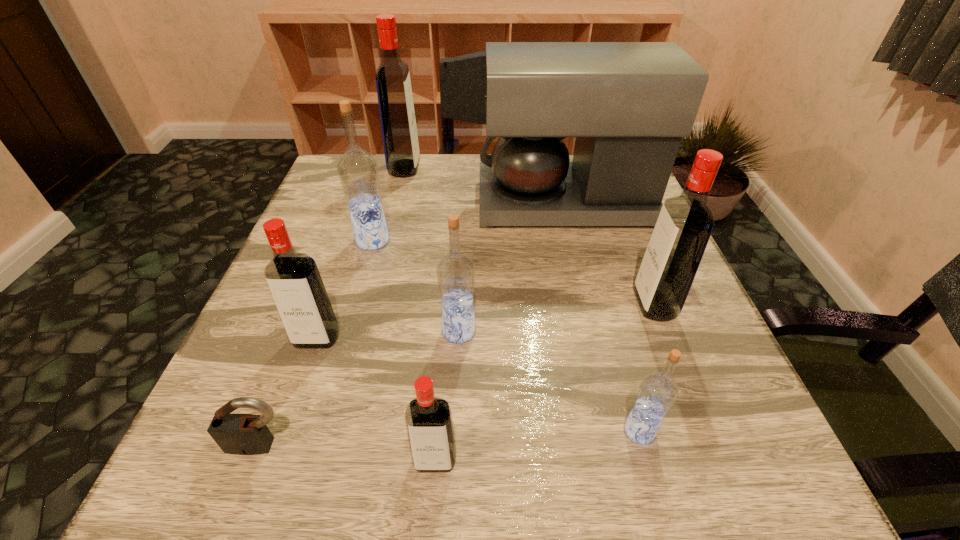
Image resolution: width=960 pixels, height=540 pixels. In order to click on the tallest vodka in this screenshot , I will do `click(398, 124)`.

Identify the location of the farthest vodka. Image resolution: width=960 pixels, height=540 pixels. (398, 124).

Where is `coffee maker`? Image resolution: width=960 pixels, height=540 pixels. coffee maker is located at coordinates (628, 104).

You are a GUI agent. You are given a task and a screenshot of the screen. Output one action in this format:
    pyautogui.click(x=<x>, y=<y>)
    Task: Click on the leftmost blue vodka
    The height and width of the screenshot is (540, 960).
    Given the screenshot: What is the action you would take?
    pyautogui.click(x=358, y=171)

Where is `the second farthest vodka`? Image resolution: width=960 pixels, height=540 pixels. the second farthest vodka is located at coordinates (358, 171).

Find the location of `the second farthest red vodka`. the second farthest red vodka is located at coordinates (685, 223).

Locate an element on the screen. the rightmost red vodka is located at coordinates (685, 223).

Locate an element on the screen. the second farthest blue vodka is located at coordinates (456, 272).

The height and width of the screenshot is (540, 960). Find the location of `the second blue vodka from left to right`. the second blue vodka from left to right is located at coordinates (456, 272).

The image size is (960, 540). I want to click on the third farthest red vodka, so click(295, 283).